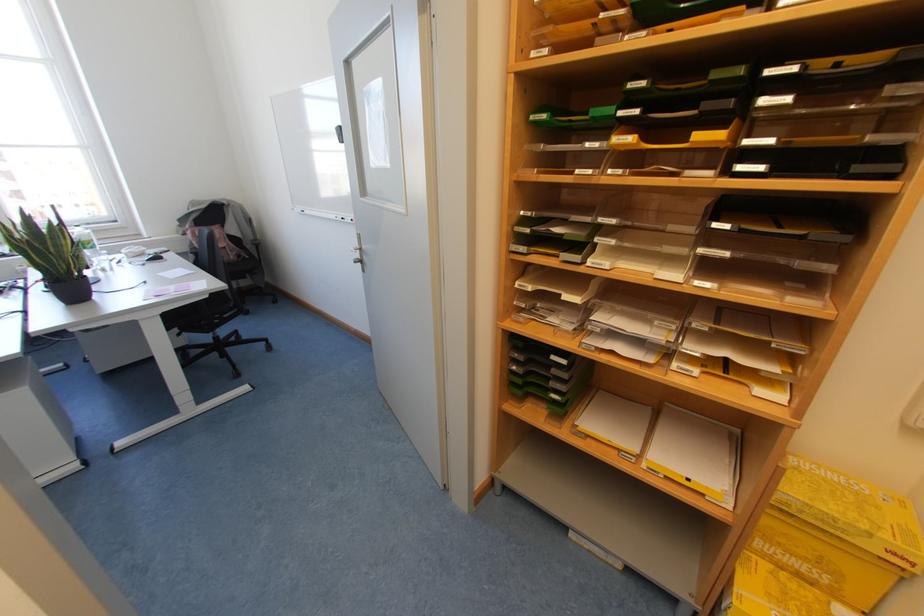
Where would you pull the yellow paper tray? Please return your answer as a coordinate pair (x, y).

(696, 453)